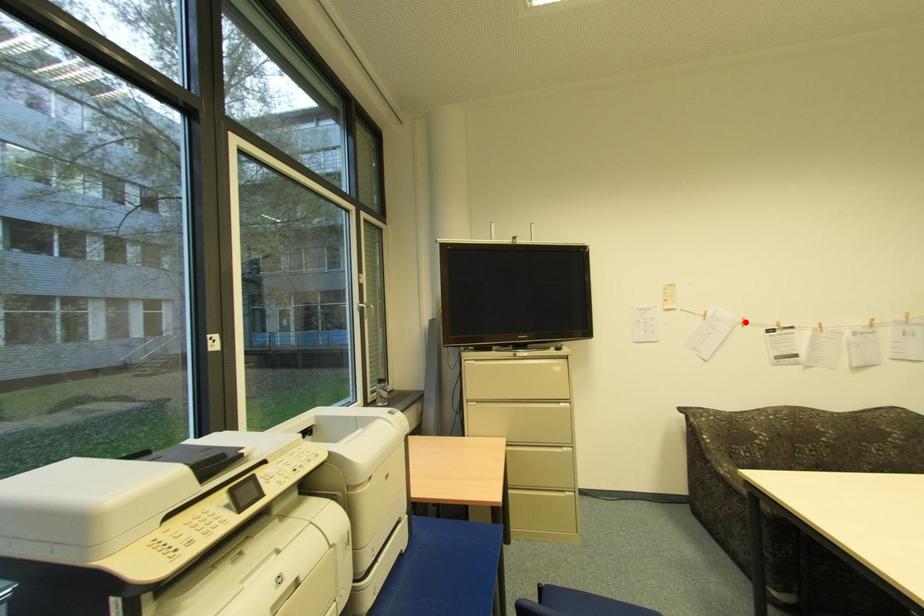
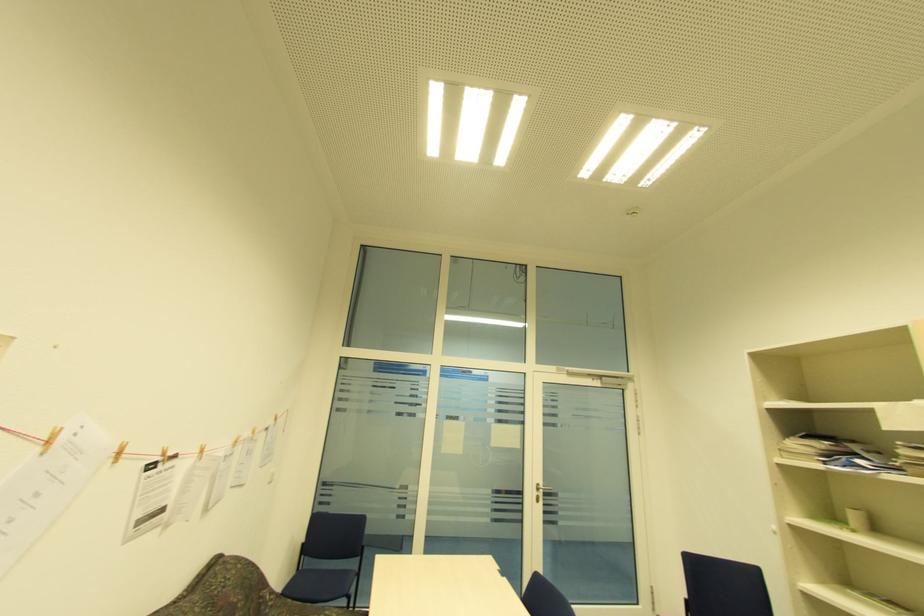
Locate, in the second image, the point that corresponds to the highlighted location in the first image.

(120, 454)